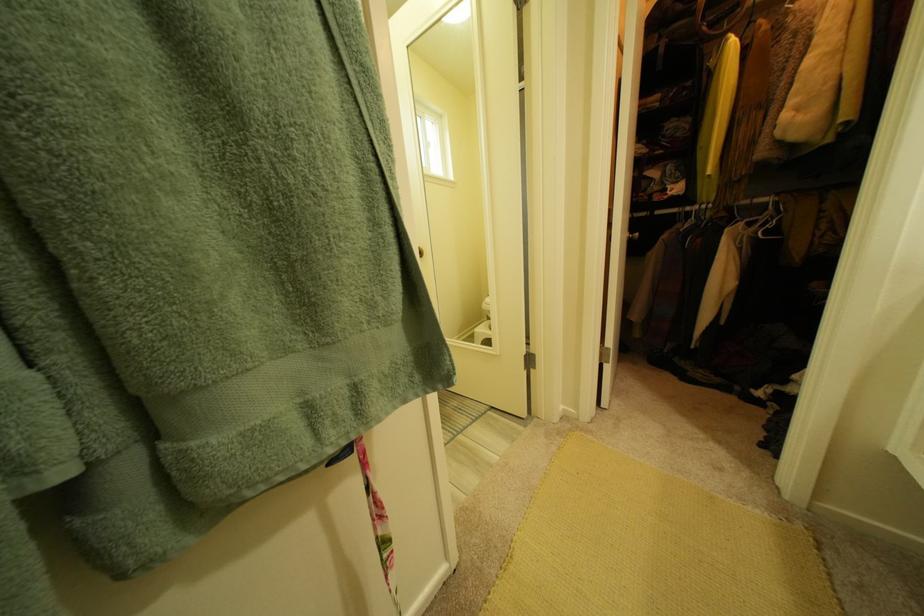
Describe the element at coordinates (419, 252) in the screenshot. The width and height of the screenshot is (924, 616). I see `the door knob` at that location.